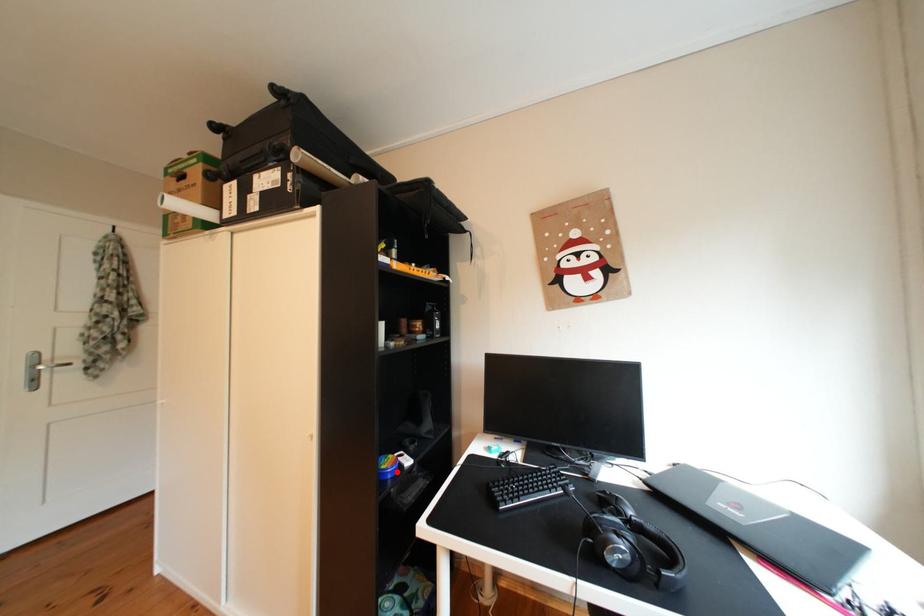
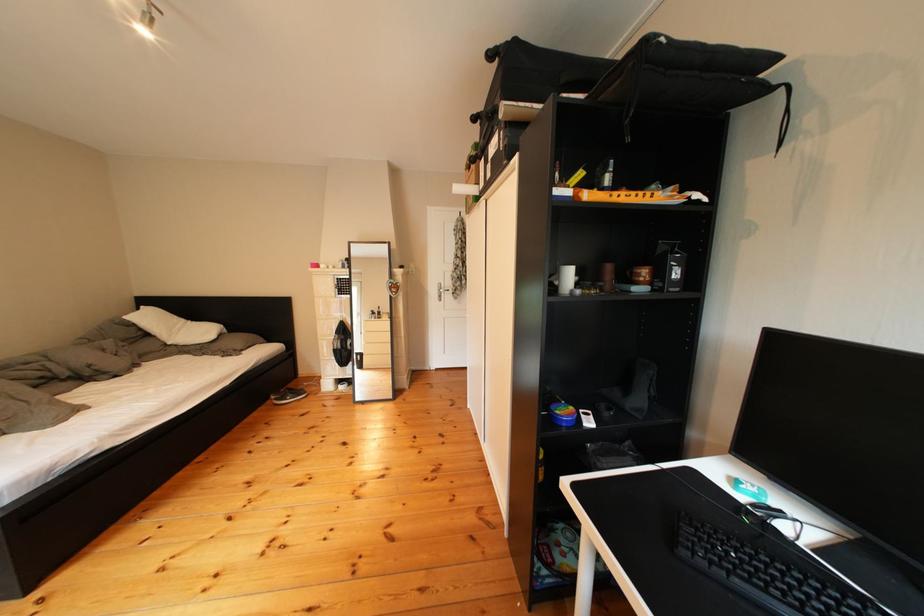
In the second image, find the point that corresponds to the highlighted location in the first image.

(572, 416)